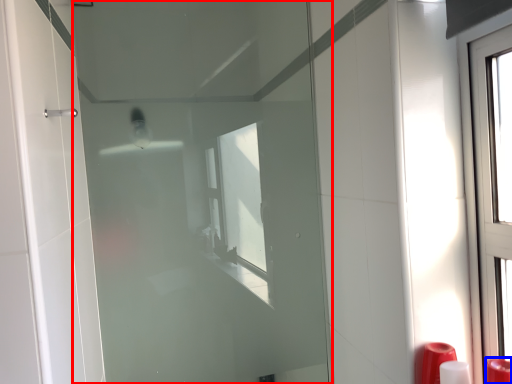
Question: Among these objects, which one is farthest to the camera, door (highlighted by a red box) or soap dispenser (highlighted by a blue box)?

Choices:
 (A) door
 (B) soap dispenser

Answer: (A)